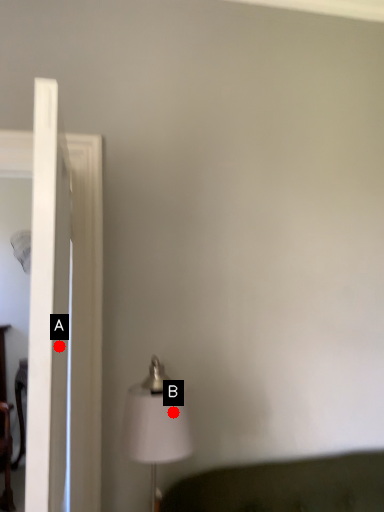
Question: Two points are circled on the image, labeled by A and B beside each circle. Which point appears closest to the camera in this image?

Choices:
 (A) A is closer
 (B) B is closer

Answer: (A)